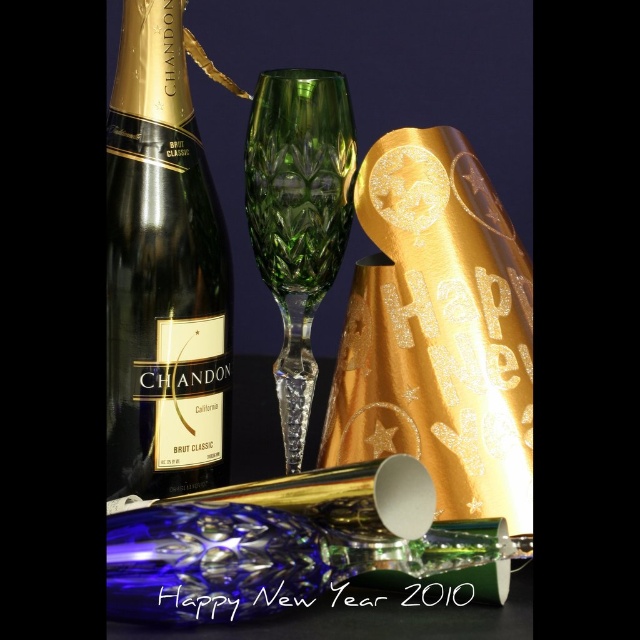
Question: Which point appears closest to the camera in this image?

Choices:
 (A) (285, 368)
 (B) (225, 253)

Answer: (A)

Question: Which of the following is the closest to the observer?

Choices:
 (A) green crystal flute at center
 (B) matte gold bottle at left

Answer: (A)

Question: Does matte gold bottle at left appear under green crystal flute at center?

Choices:
 (A) yes
 (B) no

Answer: (B)

Question: Which point appears farthest from the camera in this image?

Choices:
 (A) (145, 12)
 (B) (292, 342)

Answer: (B)

Question: Can you confirm if matte gold bottle at left is positioned to the left of green crystal flute at center?

Choices:
 (A) no
 (B) yes

Answer: (B)

Question: Is matte gold bottle at left further to camera compared to green crystal flute at center?

Choices:
 (A) no
 (B) yes

Answer: (B)